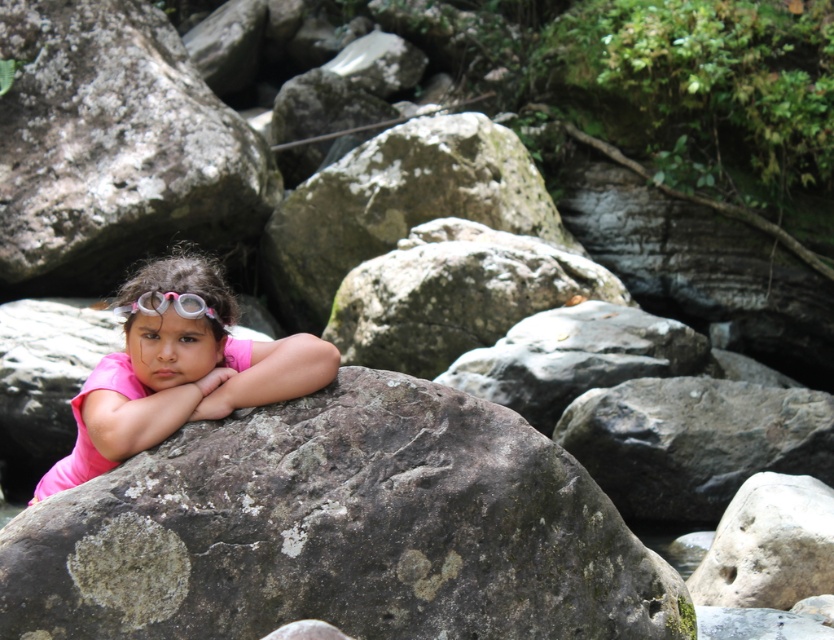
Question: Where is speckled rock at center located in relation to smooth gray rock at center in the image?

Choices:
 (A) left
 (B) right

Answer: (A)

Question: Which of these objects is positioned closest to the smooth gray rock at center?

Choices:
 (A) speckled rock at center
 (B) pink matte shirt at center

Answer: (A)

Question: Which point is farther to the camera?

Choices:
 (A) pink matte shirt at center
 (B) speckled rock at center
 (C) rough gray rock at center

Answer: (C)

Question: Among these points, which one is farthest from the camera?

Choices:
 (A) (163, 301)
 (B) (766, 564)

Answer: (B)

Question: Observing the image, what is the correct spatial positioning of smooth gray rock at center in reference to pink rubber goggles at center?

Choices:
 (A) right
 (B) left

Answer: (A)

Question: Is the position of rough gray rock at center more distant than that of pink matte shirt at center?

Choices:
 (A) no
 (B) yes

Answer: (B)